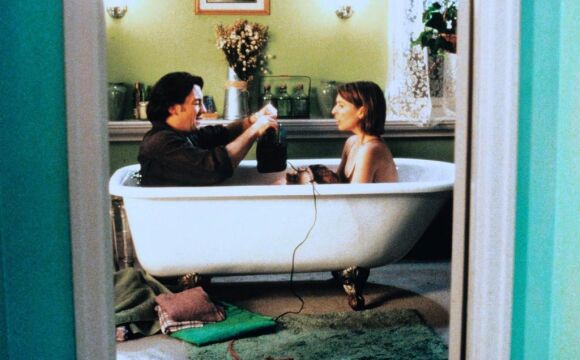
Locate an element on the screen. The image size is (580, 360). front bathtub legs is located at coordinates (351, 288), (191, 284).